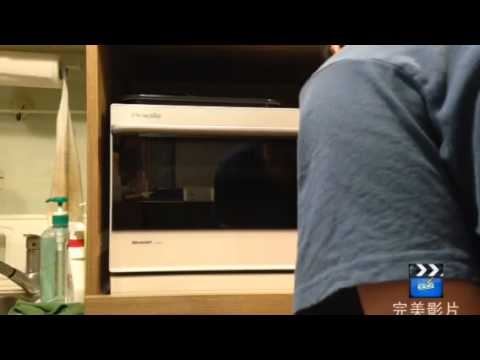
At what (x,y) coordinates should I click in order to perform the action: click on microwave. Please return your answer as a coordinate pair (x, y). The width and height of the screenshot is (480, 360). Looking at the image, I should click on (212, 185).